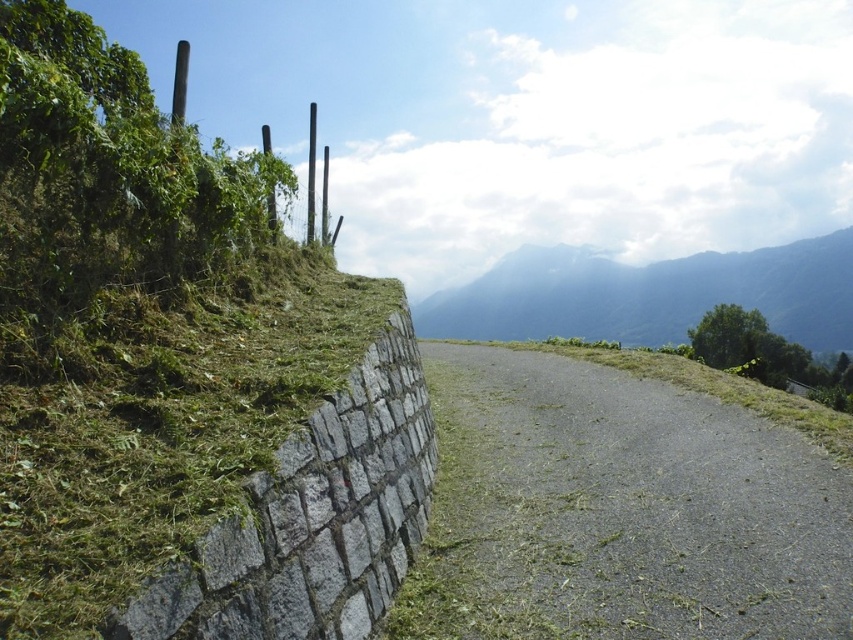
Measure the distance between green textured mountain at upper center and camera.

green textured mountain at upper center and camera are 49.41 meters apart.

Image resolution: width=853 pixels, height=640 pixels. Describe the element at coordinates (651, 294) in the screenshot. I see `green textured mountain at upper center` at that location.

Find the location of a particular element. green textured mountain at upper center is located at coordinates (651, 294).

The height and width of the screenshot is (640, 853). Find the location of `gray asphalt road at center`. gray asphalt road at center is located at coordinates (619, 512).

Identify the location of gray asphalt road at center. (619, 512).

Locate an element on the screen. The height and width of the screenshot is (640, 853). gray asphalt road at center is located at coordinates (619, 512).

Can you confirm if gray asphalt road at center is bigger than smooth gray pole at upper center?

No.

Who is positioned more to the right, gray asphalt road at center or smooth gray pole at upper center?

Positioned to the right is gray asphalt road at center.

Between point (775, 452) and point (311, 188), which one is positioned behind?

The point (311, 188) is more distant.

Locate an element on the screen. gray asphalt road at center is located at coordinates (619, 512).